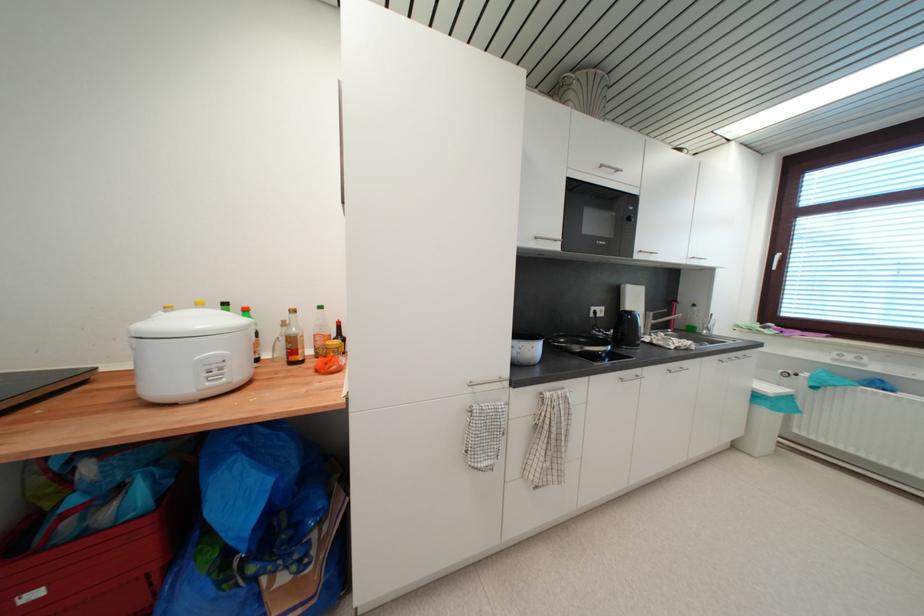
You are a GUI agent. You are given a task and a screenshot of the screen. Output one action in this format:
    pyautogui.click(x=<x>, y=<y>)
    Task: Click on the black kettle handle
    
    Given the screenshot: What is the action you would take?
    pyautogui.click(x=600, y=330)